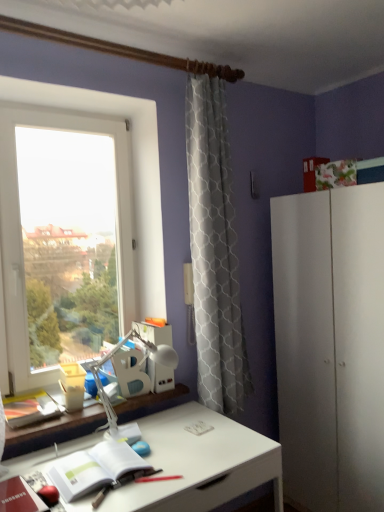
This screenshot has height=512, width=384. What do you see at coordinates (330, 346) in the screenshot?
I see `white matte cabinet at right` at bounding box center [330, 346].

What do you see at coordinates (137, 369) in the screenshot? This screenshot has height=512, width=384. I see `white plastic table lamp at center` at bounding box center [137, 369].

I want to click on transparent glass window at left, so click(117, 197).

I want to click on white glossy desk at center, so click(200, 463).

At what (x,y) coordinates should I click in order to perform the action: click on dresser below the white plastic table lamp at center (from the image's perspective). Please return your answer as a coordinate pair (x, y). The image size is (384, 512). Looking at the image, I should click on (330, 346).

Does point (328, 426) come in front of point (111, 413)?

No, it is behind (111, 413).

Is white matte cabinet at right bigger than white plastic table lamp at center?

Yes, white matte cabinet at right is bigger than white plastic table lamp at center.

From a real-world perspective, is white matte cabinet at right over white plastic table lamp at center?

No.

Does white glossy desk at center have a lesser height compared to white plastic table lamp at center?

No.

Between white glossy desk at center and white plastic table lamp at center, which one appears on the left side from the viewer's perspective?

Positioned to the left is white plastic table lamp at center.

The height and width of the screenshot is (512, 384). What are the coordinates of `desk on the right of white plastic table lamp at center` in the screenshot? It's located at (200, 463).

Is white glossy desk at center facing away from white plastic table lamp at center?

→ No.

Is white plastic table lamp at center far away from transparent glass window at left?

white plastic table lamp at center is actually quite close to transparent glass window at left.

From the image's perspective, which is below, white plastic table lamp at center or transparent glass window at left?

white plastic table lamp at center, from the image's perspective.

Consider the image. Is white plastic table lamp at center inside or outside of transparent glass window at left?

The correct answer is: outside.

From a real-world perspective, which is physically below, white matte cabinet at right or white paper notebook at lower left?

white paper notebook at lower left, from a real-world perspective.

Considering their positions, is white matte cabinet at right located in front of or behind white paper notebook at lower left?

white matte cabinet at right is positioned farther from the viewer than white paper notebook at lower left.

Where is `notebook below the white matte cabinet at right (from a real-world perspective)`? The image size is (384, 512). notebook below the white matte cabinet at right (from a real-world perspective) is located at coordinates (97, 469).

Consider the image. Is white matte cabinet at right far from white paper notebook at lower left?

Yes, white matte cabinet at right and white paper notebook at lower left are quite far apart.

Looking at this image, would you say white paper notebook at lower left is part of white glossy desk at center's contents?

Yes, white paper notebook at lower left is surrounded by white glossy desk at center.

Which is farther, (164, 419) or (97, 475)?

The point (164, 419) is more distant.

Is white glossy desk at center positioned with its back to white paper notebook at lower left?

No, white glossy desk at center's orientation is not away from white paper notebook at lower left.

This screenshot has height=512, width=384. In order to click on notebook above the white glossy desk at center (from the image's perspective) in this screenshot , I will do `click(97, 469)`.

Which is more distant, (104,362) or (124,479)?

The point (104,362) is farther from the camera.

Identify the location of notebook lying on the left of white plastic table lamp at center. point(97,469).

Measure the distance from white plastic table lamp at center to white paper notebook at lower left.

white plastic table lamp at center is 11.13 inches from white paper notebook at lower left.

Is white plastic table lamp at center positioned behind white paper notebook at lower left?

Yes, it is behind white paper notebook at lower left.

What's the angular difference between white paper notebook at lower left and white matte cabinet at right's facing directions?

There is a 91.1-degree angle between the facing directions of white paper notebook at lower left and white matte cabinet at right.

From the image's perspective, is white paper notebook at lower left above white matte cabinet at right?

Actually, white paper notebook at lower left appears below white matte cabinet at right in the image.

Is white paper notebook at lower left spatially inside white matte cabinet at right, or outside of it?

white paper notebook at lower left is spatially situated outside white matte cabinet at right.

Identify the location of dresser that appears behind the white plastic table lamp at center. (330, 346).

Identify the location of table lamp on the left of the white glossy desk at center. The width and height of the screenshot is (384, 512). (137, 369).

Based on their spatial positions, is white matte cabinet at right or white glossy desk at center closer to white plastic table lamp at center?

white glossy desk at center is positioned closer to the anchor white plastic table lamp at center.

When comparing their distances from white glossy desk at center, does white plastic table lamp at center or white paper notebook at lower left seem further?

white plastic table lamp at center lies further to white glossy desk at center than the other object.

Which object lies nearer to the anchor point white matte cabinet at right, white plastic table lamp at center or white glossy desk at center?

white glossy desk at center lies closer to white matte cabinet at right than the other object.

Which object lies further to the anchor point white matte cabinet at right, white plastic table lamp at center or transparent glass window at left?

The object further to white matte cabinet at right is transparent glass window at left.

Looking at this image, looking at the image, which one is located closer to white glossy desk at center, white paper notebook at lower left or transparent glass window at left?

white paper notebook at lower left is positioned closer to the anchor white glossy desk at center.

Looking at the image, which one is located further to transparent glass window at left, white paper notebook at lower left or white plastic table lamp at center?

white paper notebook at lower left is positioned further to the anchor transparent glass window at left.

Considering their positions, is white matte cabinet at right positioned closer to white paper notebook at lower left than white plastic table lamp at center?

white plastic table lamp at center is closer to white paper notebook at lower left.

Considering their positions, is white plastic table lamp at center positioned closer to white paper notebook at lower left than white matte cabinet at right?

Among the two, white plastic table lamp at center is located nearer to white paper notebook at lower left.

The width and height of the screenshot is (384, 512). What are the coordinates of `table lamp located between white paper notebook at lower left and white matte cabinet at right in the left-right direction` in the screenshot? It's located at (137, 369).

The width and height of the screenshot is (384, 512). I want to click on notebook between white plastic table lamp at center and white glossy desk at center from top to bottom, so click(97, 469).

Where is `table lamp between transparent glass window at left and white matte cabinet at right in the horizontal direction`? This screenshot has height=512, width=384. table lamp between transparent glass window at left and white matte cabinet at right in the horizontal direction is located at coordinates (137, 369).

I want to click on table lamp between transparent glass window at left and white paper notebook at lower left from top to bottom, so click(137, 369).